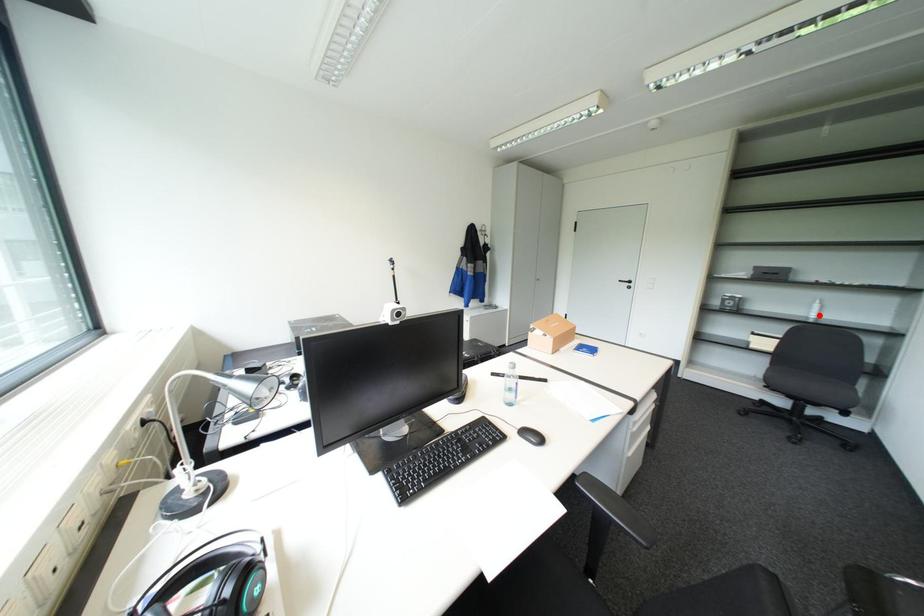
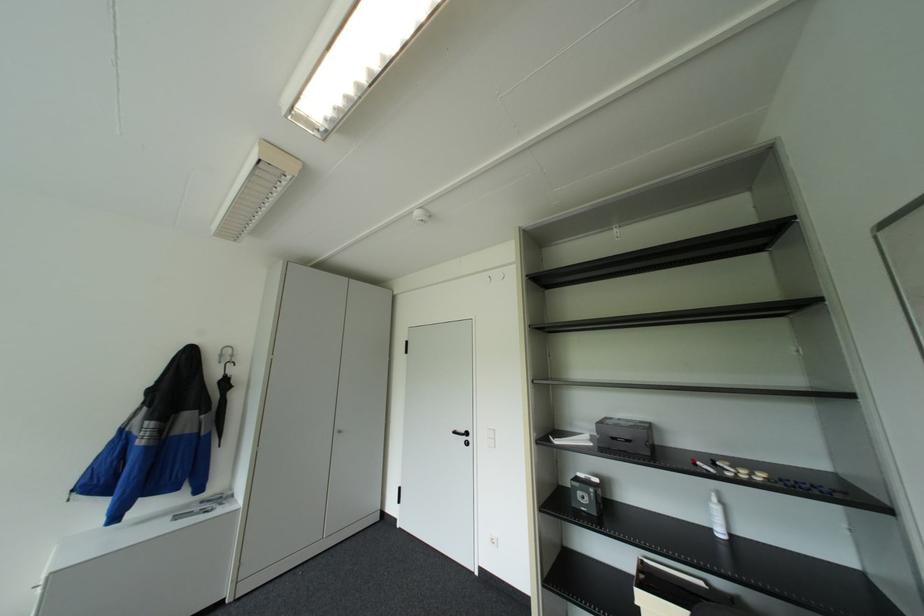
Find the pixel in the second image that matches the highlighted location in the first image.

(725, 533)